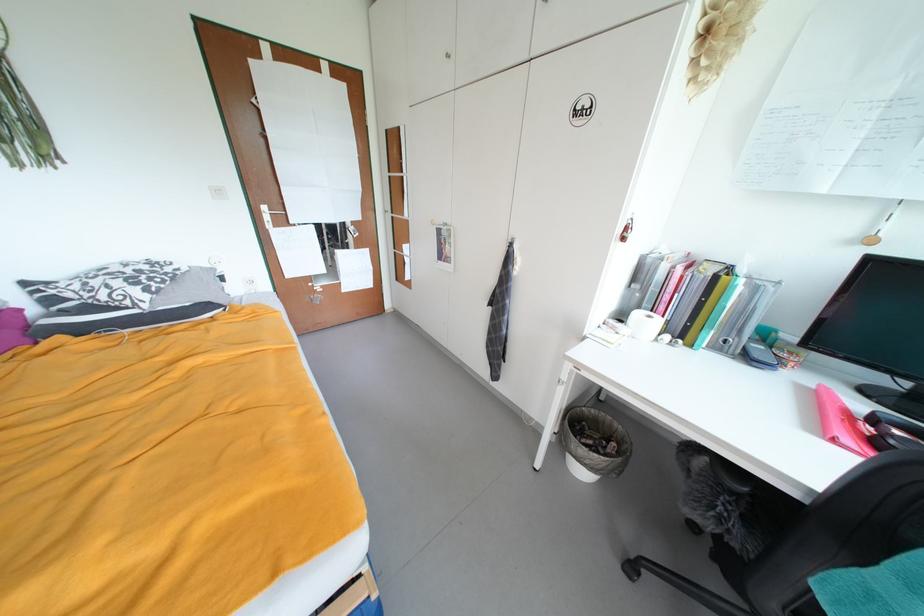
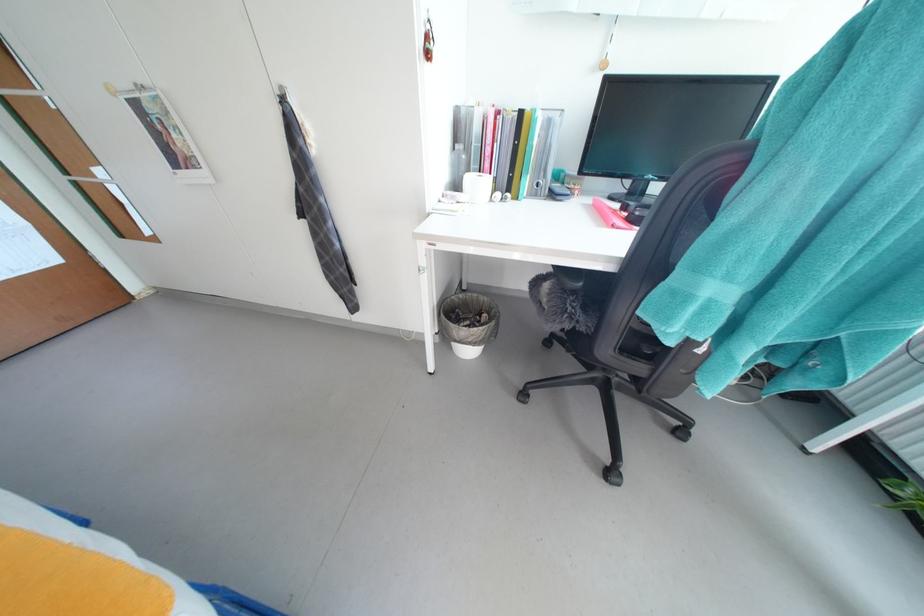
Find the pixel in the second image that matches [675,323] in the first image.

(503, 182)